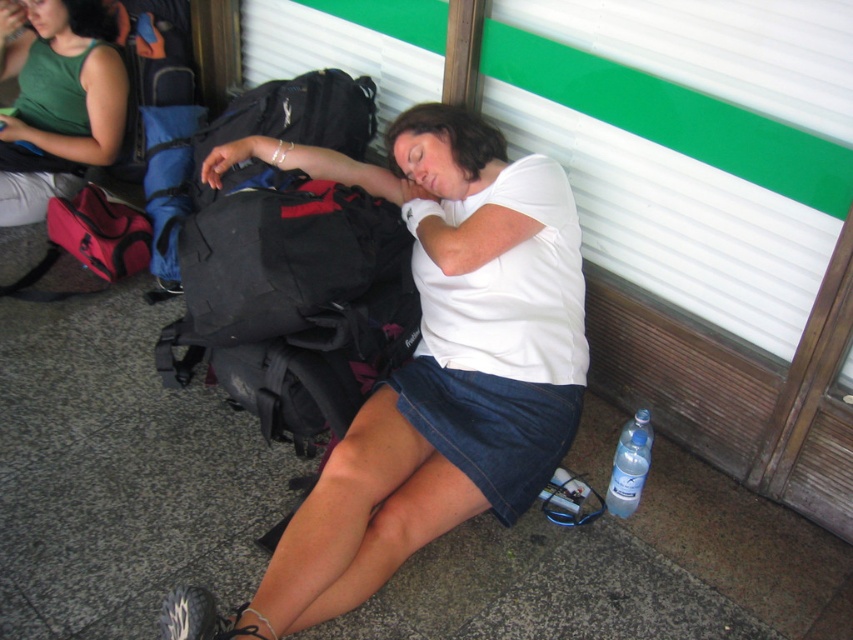
Can you confirm if denim skirt at lower center is positioned to the left of clear plastic bottle at lower right?

Yes, denim skirt at lower center is to the left of clear plastic bottle at lower right.

Based on the photo, which is more to the right, denim skirt at lower center or clear plastic bottle at lower right?

clear plastic bottle at lower right

Does point (485, 380) come behind point (618, 444)?

No, (485, 380) is in front of (618, 444).

Locate an element on the screen. denim skirt at lower center is located at coordinates (490, 428).

Does white matte shirt at center have a larger size compared to clear plastic bottle at lower center?

Yes, white matte shirt at center is bigger than clear plastic bottle at lower center.

Between white matte shirt at center and clear plastic bottle at lower center, which one appears on the left side from the viewer's perspective?

Positioned to the left is white matte shirt at center.

Is point (355, 576) behind point (619, 440)?

No, it is not.

I want to click on white matte shirt at center, so click(x=440, y=358).

Between green sleeveless top at upper left and denim skirt at lower center, which one appears on the right side from the viewer's perspective?

denim skirt at lower center

Is green sleeveless top at upper left above denim skirt at lower center?

Yes, green sleeveless top at upper left is above denim skirt at lower center.

Find the location of a particular element. green sleeveless top at upper left is located at coordinates (56, 100).